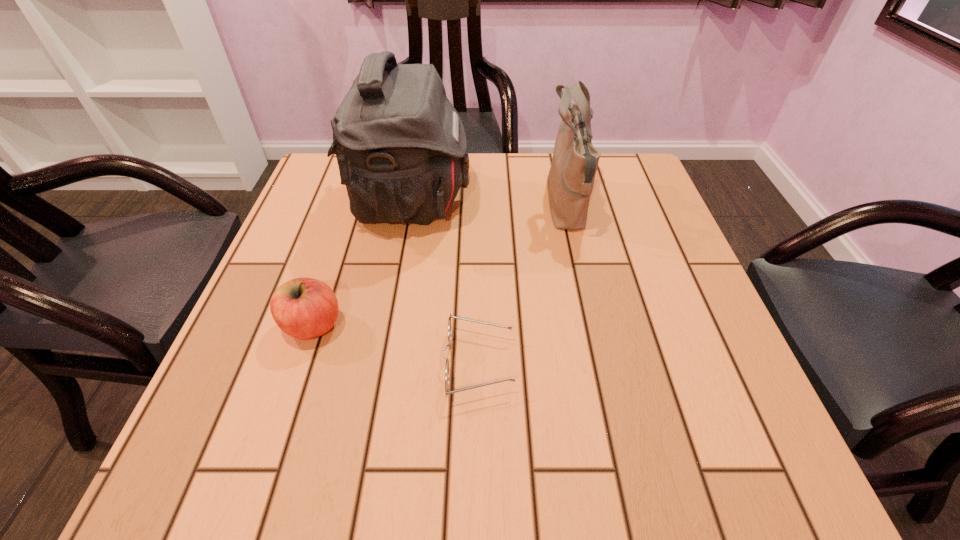
At what (x,y) coordinates should I click in order to perform the action: click on free point between the spectacles and the third tallest object. Please return your answer as a coordinate pair (x, y). Looking at the image, I should click on (396, 345).

This screenshot has width=960, height=540. What are the coordinates of `empty space that is in between the shortest object and the second tallest object` in the screenshot? It's located at (522, 285).

Locate an element on the screen. empty location between the taller shoulder bag and the third shortest object is located at coordinates (489, 204).

Where is `vacant area between the spectacles and the left shoulder bag`? This screenshot has height=540, width=960. vacant area between the spectacles and the left shoulder bag is located at coordinates (444, 283).

In order to click on unoccupied position between the shorter shoulder bag and the spectacles in this screenshot , I will do `click(522, 285)`.

At what (x,y) coordinates should I click in order to perform the action: click on free space between the right shoulder bag and the left shoulder bag. Please return your answer as a coordinate pair (x, y). This screenshot has height=540, width=960. Looking at the image, I should click on (489, 204).

Find the location of a particular element. This screenshot has height=540, width=960. free space between the second shortest object and the taller shoulder bag is located at coordinates (362, 264).

Identify the location of free area in between the third tallest object and the spectacles. (396, 345).

At what (x,y) coordinates should I click in order to perform the action: click on vacant space that's between the third tallest object and the third shortest object. Please return your answer as a coordinate pair (x, y). Looking at the image, I should click on (440, 266).

This screenshot has width=960, height=540. I want to click on unoccupied area between the spectacles and the apple, so click(396, 345).